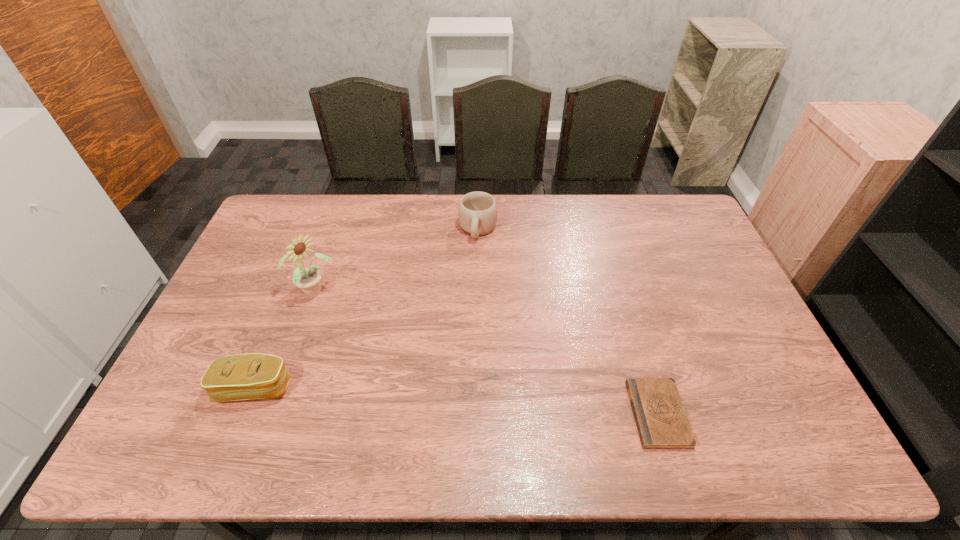
Locate an element on the screen. This screenshot has height=540, width=960. vacant area that lies between the clutch bag and the rightmost object is located at coordinates (456, 401).

Where is `free space that is in between the tallest object and the mug`? free space that is in between the tallest object and the mug is located at coordinates (396, 260).

Identify the location of vacant space that is in between the tallest object and the shortest object. (486, 353).

The height and width of the screenshot is (540, 960). I want to click on vacant area that lies between the tallest object and the mug, so click(396, 260).

At what (x,y) coordinates should I click in order to perform the action: click on free space between the diary and the clutch bag. Please return your answer as a coordinate pair (x, y). Looking at the image, I should click on (456, 401).

Locate an element on the screen. The height and width of the screenshot is (540, 960). vacant region between the tallest object and the clutch bag is located at coordinates (284, 340).

Find the location of a particular element. The height and width of the screenshot is (540, 960). unoccupied area between the clutch bag and the second object from right to left is located at coordinates (366, 308).

Locate an element on the screen. the third closest object relative to the shortest object is located at coordinates (249, 376).

Identify which object is located as the second nearest to the shortest object. Please provide its 2D coordinates. Your answer should be formatted as a tuple, i.e. [(x, y)], where the tuple contains the x and y coordinates of a point satisfying the conditions above.

[(308, 279)]

I want to click on free space in the image that satisfies the following two spatial constraints: 1. on the front side of the tallest object; 2. on the spine side of the shortest object, so click(x=272, y=414).